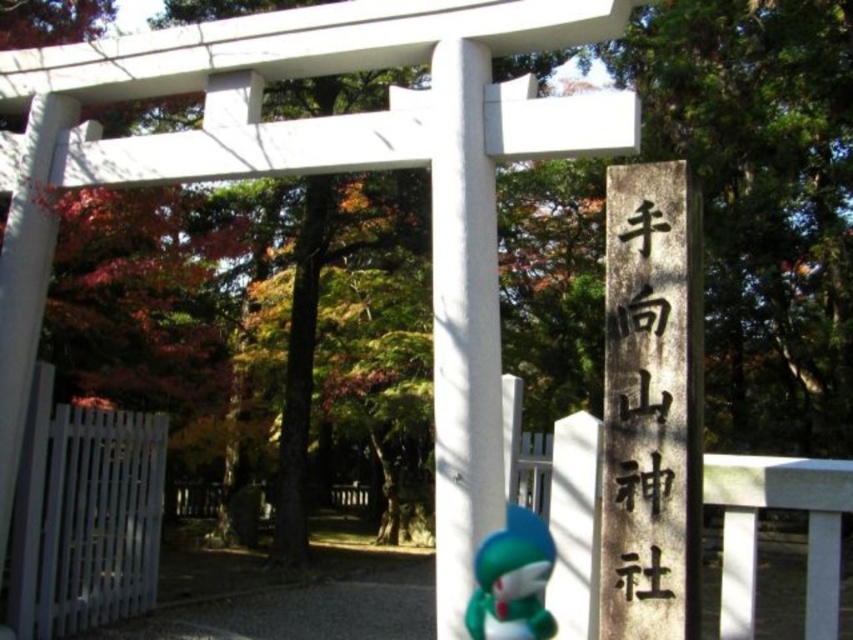
Question: In this image, where is black stone sign at right located relative to green matte plush toy at lower center?

Choices:
 (A) right
 (B) left

Answer: (A)

Question: Observing the image, what is the correct spatial positioning of black stone sign at right in reference to green matte plush toy at lower center?

Choices:
 (A) right
 (B) left

Answer: (A)

Question: Which point is farther to the camera?

Choices:
 (A) (526, 524)
 (B) (610, 577)

Answer: (A)

Question: Where is black stone sign at right located in relation to green matte plush toy at lower center in the image?

Choices:
 (A) right
 (B) left

Answer: (A)

Question: Which of the following is the closest to the observer?

Choices:
 (A) (506, 586)
 (B) (680, 358)

Answer: (B)